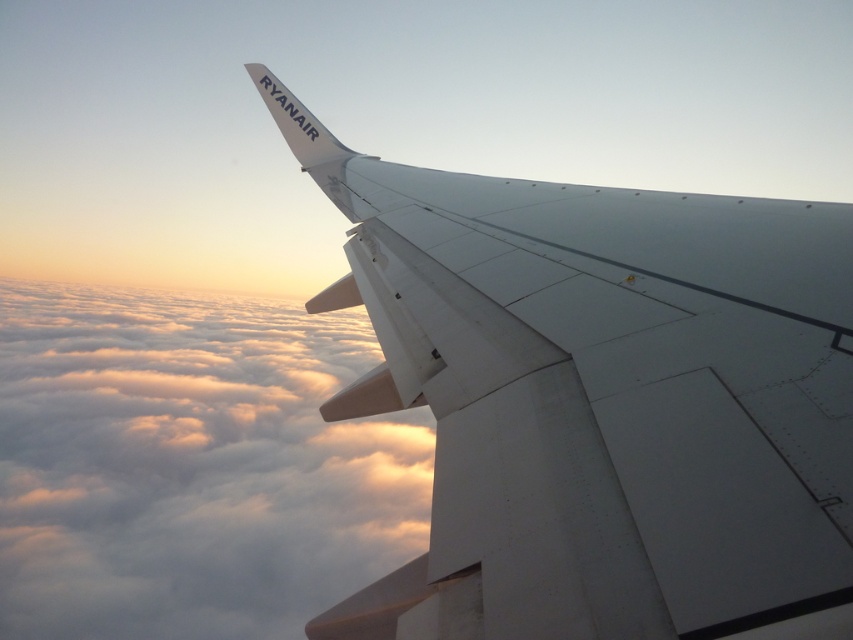
You are a pilot flying at 30,000 feet altitude and notice the white matte wing at upper center and the white fluffy cloud at upper center. According to aviation safety guidelines, what is the minimum vertical distance required between the aircraft and clouds? Can you determine if the aircraft is compliant with this regulation based on their current separation?

The minimum vertical distance required between an aircraft and clouds is 1,000 feet. The white matte wing at upper center and white fluffy cloud at upper center are 1747.12 feet apart, which exceeds the required 1,000 feet separation. Therefore, the aircraft is compliant with aviation safety guidelines.

You are a flight attendant looking out the window and see the white matte wing at upper center and the white fluffy cloud at upper center. Which object is narrower in width?

The white matte wing at upper center is narrower in width than the white fluffy cloud at upper center.

You are a passenger sitting at seat 12A in an airplane. You look out the window and see a point marked at coordinates (601, 401). What object do you see at that point?

At point (601, 401) lies the white matte wing at upper center.